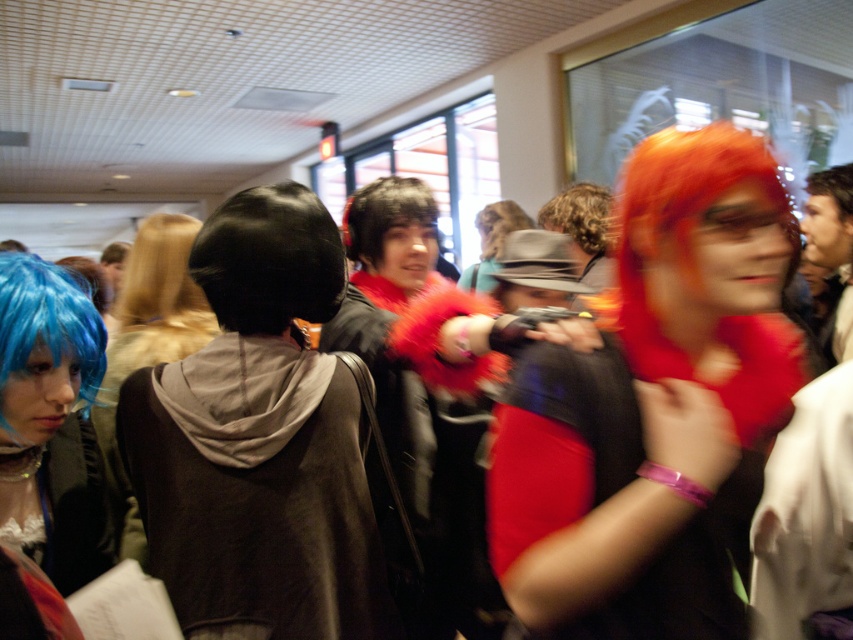
Can you confirm if blue wig at left is wider than black matte wig at center?

No, blue wig at left is not wider than black matte wig at center.

Between point (59, 522) and point (233, 204), which one is positioned in front?

Point (233, 204) is more forward.

Find the location of a particular element. blue wig at left is located at coordinates (50, 420).

Does blondehair at center appear on the right side of blue matte wig at lower left?

Correct, you'll find blondehair at center to the right of blue matte wig at lower left.

Who is more forward, (129, 272) or (76, 275)?

Point (76, 275)

You are a GUI agent. You are given a task and a screenshot of the screen. Output one action in this format:
    pyautogui.click(x=<x>, y=<y>)
    Task: Click on the blondehair at center
    The width and height of the screenshot is (853, 640).
    Given the screenshot: What is the action you would take?
    pyautogui.click(x=158, y=273)

Does shiny brown hair at center have a larger size compared to orange matte wig at upper right?

Yes.

Image resolution: width=853 pixels, height=640 pixels. What do you see at coordinates (498, 225) in the screenshot?
I see `shiny brown hair at center` at bounding box center [498, 225].

What do you see at coordinates (498, 225) in the screenshot? Image resolution: width=853 pixels, height=640 pixels. I see `shiny brown hair at center` at bounding box center [498, 225].

Where is `shiny brown hair at center`? shiny brown hair at center is located at coordinates (498, 225).